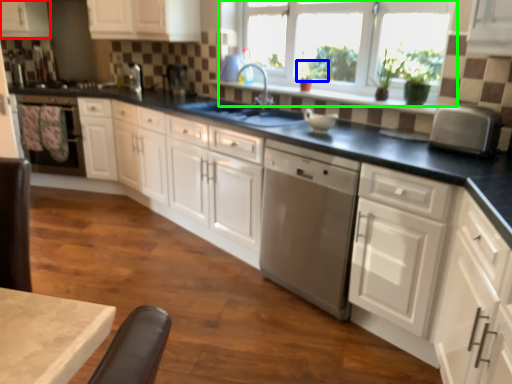
Question: Considering the real-world distances, which object is closest to cabinetry (highlighted by a red box)? plant (highlighted by a blue box) or window (highlighted by a green box).

Choices:
 (A) plant
 (B) window

Answer: (B)